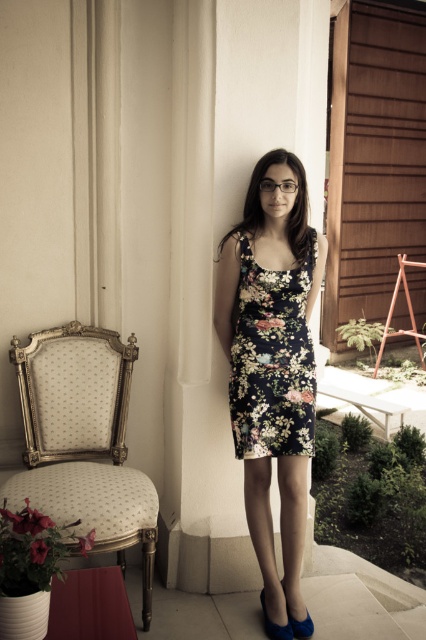
Can you confirm if floral fabric dress at center is smaller than gold-patterned armchair at left?

Yes.

Can you confirm if floral fabric dress at center is bigger than gold-patterned armchair at left?

Incorrect, floral fabric dress at center is not larger than gold-patterned armchair at left.

Is point (276, 224) positioned before point (137, 538)?

That is False.

Find the location of `floral fabric dress at center`. floral fabric dress at center is located at coordinates (271, 360).

Is floral fabric dress at center further to the viewer compared to blue suede shoe at lower center?

That is False.

Describe the element at coordinates (271, 360) in the screenshot. I see `floral fabric dress at center` at that location.

Where is `floral fabric dress at center`? This screenshot has width=426, height=640. floral fabric dress at center is located at coordinates (271, 360).

Is gold-patterned armchair at left to the right of floral-patterned fabric dress at center from the viewer's perspective?

No, gold-patterned armchair at left is not to the right of floral-patterned fabric dress at center.

Can you confirm if gold-patterned armchair at left is positioned above floral-patterned fabric dress at center?

Actually, gold-patterned armchair at left is below floral-patterned fabric dress at center.

Where is `gold-patterned armchair at left`? This screenshot has height=640, width=426. gold-patterned armchair at left is located at coordinates (83, 440).